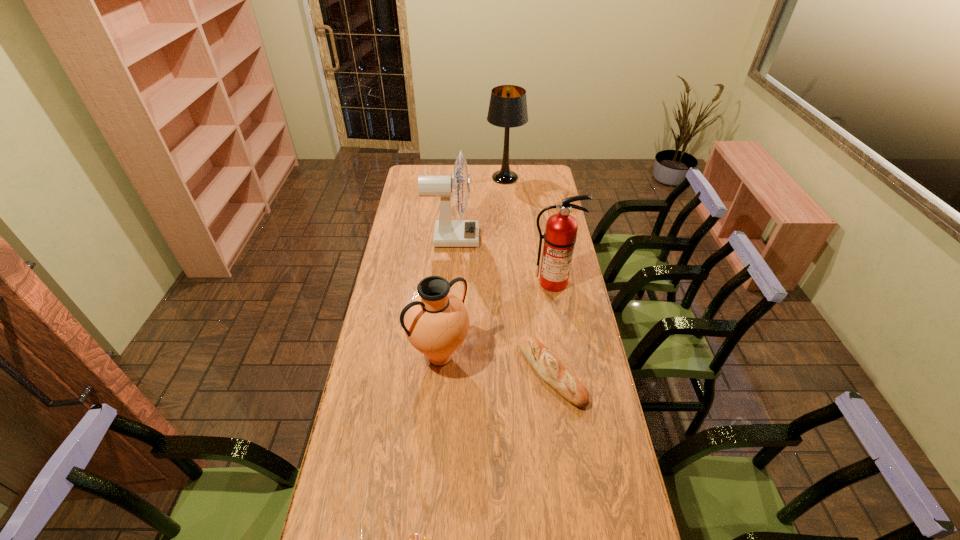
In order to click on vacant region between the baguet and the table lamp in this screenshot , I will do coord(528,275).

Find the location of a particular element. This screenshot has height=540, width=960. free space between the fourth tallest object and the shortest object is located at coordinates (x=495, y=365).

The width and height of the screenshot is (960, 540). I want to click on free spot between the farthest object and the baguet, so click(x=528, y=275).

Locate an element on the screen. Image resolution: width=960 pixels, height=540 pixels. object that can be found as the fourth closest to the shortest object is located at coordinates pyautogui.click(x=448, y=233).

Find the location of `object that is the fourth closest one to the shortest object`. object that is the fourth closest one to the shortest object is located at coordinates 448,233.

The height and width of the screenshot is (540, 960). What are the coordinates of `free spot that satisfies the following two spatial constraints: 1. on the front side of the baguet; 2. on the left side of the fourth tallest object` in the screenshot? It's located at tap(439, 373).